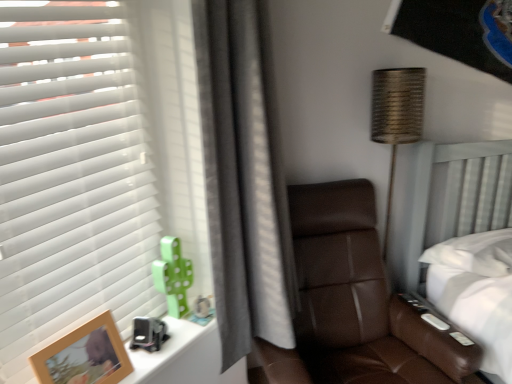
Identify the location of green matte cactus at left. (173, 276).

What are the coordinates of `gray fabric curtain at center` in the screenshot? It's located at (243, 178).

From the image's perspective, is green matte cactus at left above wooden photo frame at lower left?

Yes.

From a real-world perspective, between green matte cactus at left and wooden photo frame at lower left, who is vertically lower?

wooden photo frame at lower left is physically lower.

Between wooden photo frame at lower left and gray fabric curtain at center, which one has smaller size?

wooden photo frame at lower left is smaller.

Is wooden photo frame at lower left facing away from gray fabric curtain at center?

No, wooden photo frame at lower left's orientation is not away from gray fabric curtain at center.

Which is more to the right, wooden photo frame at lower left or gray fabric curtain at center?

gray fabric curtain at center.

Choose the correct answer: Is white matte window blind at left inside green matte cactus at left or outside it?

white matte window blind at left cannot be found inside green matte cactus at left.

Is white matte window blind at left in front of green matte cactus at left?

Yes, white matte window blind at left is in front of green matte cactus at left.

Image resolution: width=512 pixels, height=384 pixels. I want to click on toy that is on the right side of white matte window blind at left, so click(x=173, y=276).

Based on their sizes in the image, would you say white matte window blind at left is bigger or smaller than green matte cactus at left?

white matte window blind at left is bigger than green matte cactus at left.

From the picture: Is green matte cactus at left at the left side of brown leather chair at center?

Yes, green matte cactus at left is to the left of brown leather chair at center.

From a real-world perspective, between green matte cactus at left and brown leather chair at center, who is vertically higher?

green matte cactus at left is physically above.

From the picture: Is green matte cactus at left in front of or behind brown leather chair at center in the image?

In the image, green matte cactus at left appears behind brown leather chair at center.

Which is further, (166, 236) or (305, 238)?

The point (305, 238) is behind.

In terms of size, does green matte cactus at left appear bigger or smaller than white matte window blind at left?

In the image, green matte cactus at left appears to be smaller than white matte window blind at left.

From the image's perspective, which object appears higher, green matte cactus at left or white matte window blind at left?

From the image's view, white matte window blind at left is above.

Is white matte window blind at left at the back of green matte cactus at left?

Correct, green matte cactus at left is looking away from white matte window blind at left.

From a real-world perspective, which is physically above, green matte cactus at left or white matte window blind at left?

white matte window blind at left.

What are the coordinates of `chair below the wooden photo frame at lower left (from the image's perspective)` in the screenshot? It's located at (356, 304).

From the image's perspective, which one is positioned lower, brown leather chair at center or wooden photo frame at lower left?

brown leather chair at center appears lower in the image.

How different are the orientations of brown leather chair at center and wooden photo frame at lower left in degrees?

The angular difference between brown leather chair at center and wooden photo frame at lower left is 42.2 degrees.

Considering the sizes of wooden photo frame at lower left and brown leather chair at center in the image, is wooden photo frame at lower left wider or thinner than brown leather chair at center?

wooden photo frame at lower left is thinner than brown leather chair at center.

Is wooden photo frame at lower left turned away from brown leather chair at center?

No, brown leather chair at center is not at the back of wooden photo frame at lower left.

Considering the relative positions of wooden photo frame at lower left and brown leather chair at center in the image provided, is wooden photo frame at lower left behind brown leather chair at center?

No.

Image resolution: width=512 pixels, height=384 pixels. In order to click on toy behind the wooden photo frame at lower left in this screenshot , I will do `click(173, 276)`.

Where is `picture frame below the gray fabric curtain at center (from the image's perspective)`? picture frame below the gray fabric curtain at center (from the image's perspective) is located at coordinates (84, 356).

From the image, which object appears to be nearer to wooden photo frame at lower left, brown leather chair at center or white matte window blind at left?

white matte window blind at left is positioned closer to the anchor wooden photo frame at lower left.

Which object lies further to the anchor point white matte window blind at left, green matte cactus at left or brown leather chair at center?

brown leather chair at center is positioned further to the anchor white matte window blind at left.

Estimate the real-world distances between objects in this image. Which object is further from green matte cactus at left, brown leather chair at center or white matte window blind at left?

brown leather chair at center lies further to green matte cactus at left than the other object.

Considering their positions, is brown leather chair at center positioned further to gray fabric curtain at center than white matte window blind at left?

brown leather chair at center is positioned further to the anchor gray fabric curtain at center.

Which object lies further to the anchor point gray fabric curtain at center, white matte window blind at left or wooden photo frame at lower left?

Among the two, wooden photo frame at lower left is located further to gray fabric curtain at center.

Considering their positions, is wooden photo frame at lower left positioned closer to white matte window blind at left than gray fabric curtain at center?

wooden photo frame at lower left lies closer to white matte window blind at left than the other object.

Which object lies nearer to the anchor point gray fabric curtain at center, wooden photo frame at lower left or green matte cactus at left?

The object closer to gray fabric curtain at center is green matte cactus at left.

Estimate the real-world distances between objects in this image. Which object is further from gray fabric curtain at center, brown leather chair at center or wooden photo frame at lower left?

The object further to gray fabric curtain at center is wooden photo frame at lower left.

This screenshot has height=384, width=512. What are the coordinates of `toy located between white matte window blind at left and brown leather chair at center in the left-right direction` in the screenshot? It's located at (173, 276).

You are a GUI agent. You are given a task and a screenshot of the screen. Output one action in this format:
    pyautogui.click(x=<x>, y=<y>)
    Task: Click on the toy between wooden photo frame at lower left and brown leather chair at center from left to right
    This screenshot has height=384, width=512.
    Given the screenshot: What is the action you would take?
    pyautogui.click(x=173, y=276)

You are a GUI agent. You are given a task and a screenshot of the screen. Output one action in this format:
    pyautogui.click(x=<x>, y=<y>)
    Task: Click on the curtain between wooden photo frame at lower left and brown leather chair at center from left to right
    
    Given the screenshot: What is the action you would take?
    pyautogui.click(x=243, y=178)

This screenshot has height=384, width=512. Identify the location of picture frame positioned between white matte window blind at left and green matte cactus at left from near to far. coord(84,356).